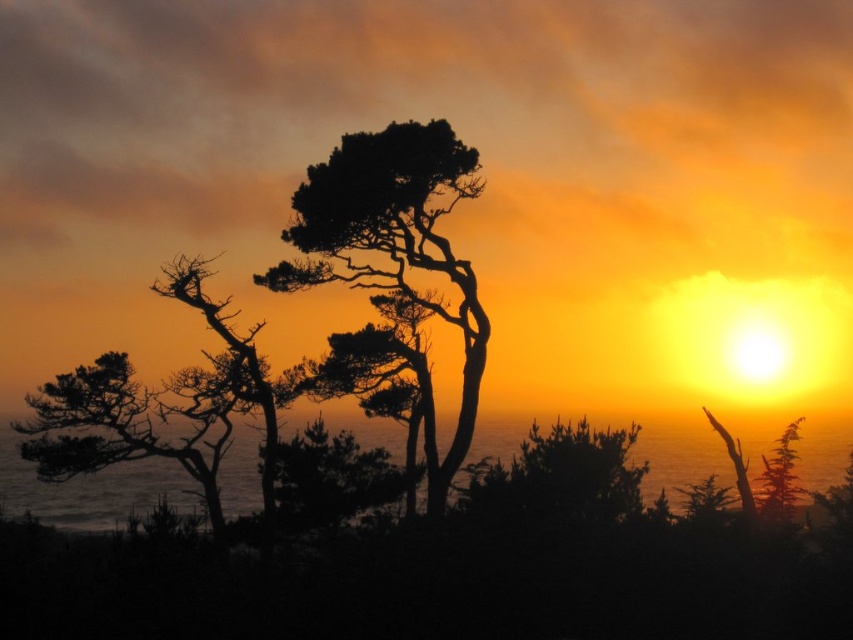
This screenshot has width=853, height=640. What do you see at coordinates (392, 268) in the screenshot? I see `silhouette bark tree at center` at bounding box center [392, 268].

Measure the distance between silhouette bark tree at center and camera.

silhouette bark tree at center is 25.51 meters from camera.

Image resolution: width=853 pixels, height=640 pixels. I want to click on silhouette bark tree at center, so click(x=392, y=268).